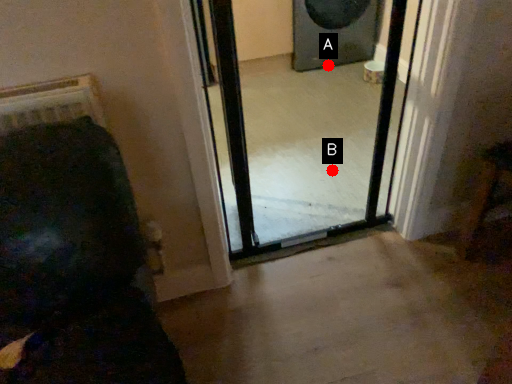
Question: Two points are circled on the image, labeled by A and B beside each circle. Among these points, which one is farthest from the camera?

Choices:
 (A) A is further
 (B) B is further

Answer: (A)